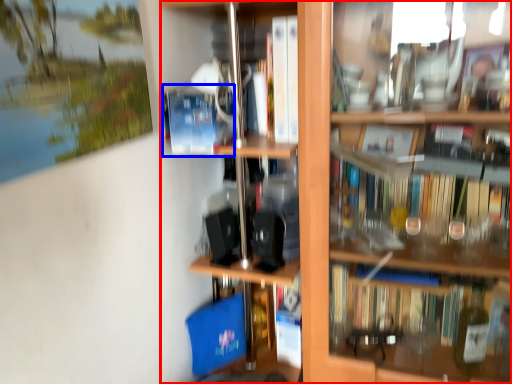
Question: Among these objects, which one is nearest to the camera, shelf (highlighted by a red box) or paperback book (highlighted by a blue box)?

Choices:
 (A) shelf
 (B) paperback book

Answer: (A)